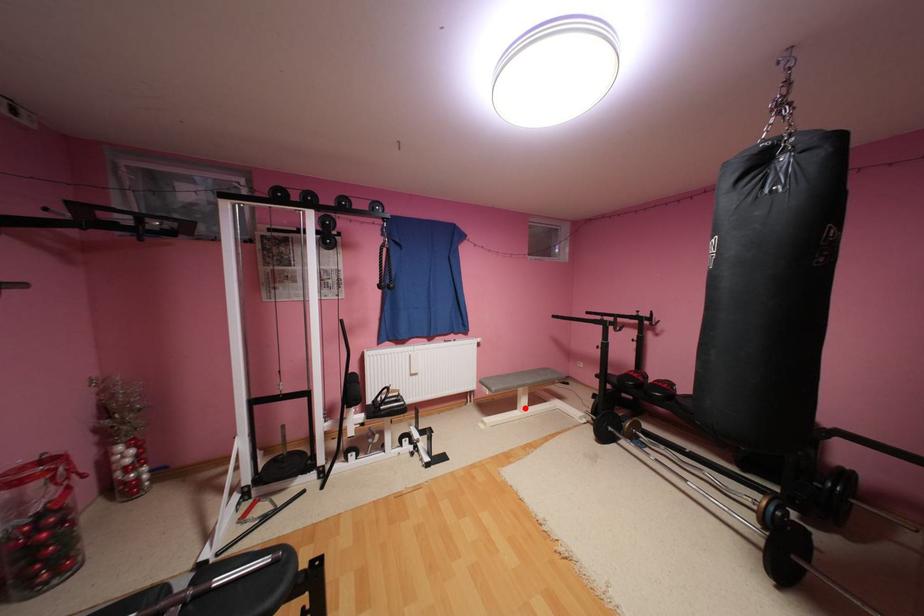
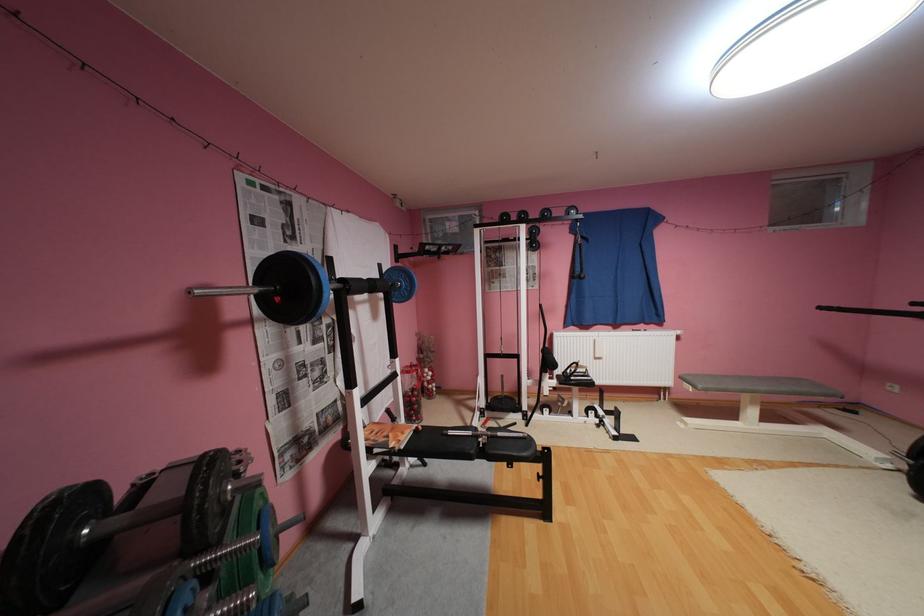
The point at the highlighted location is marked in the first image. Where is the corresponding point in the second image?

(746, 419)